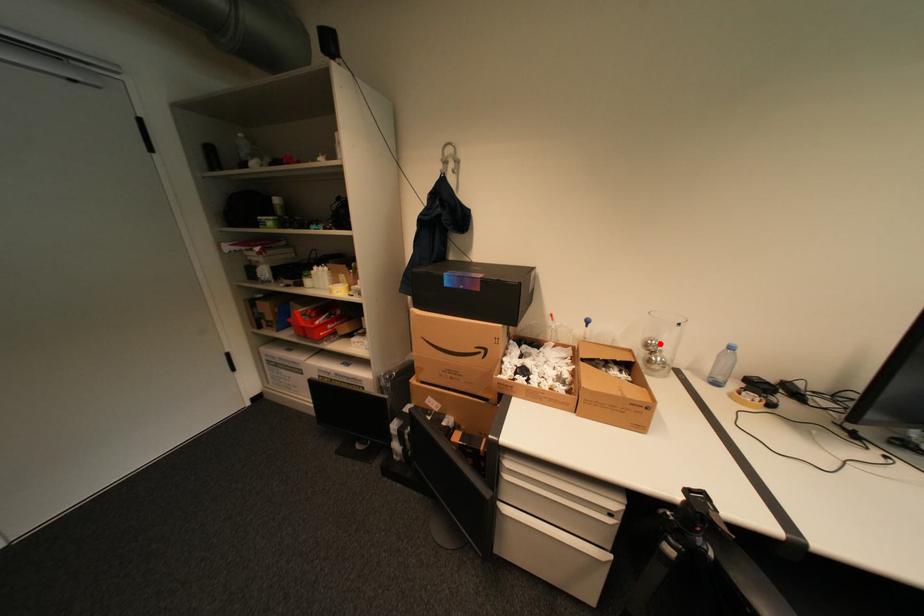
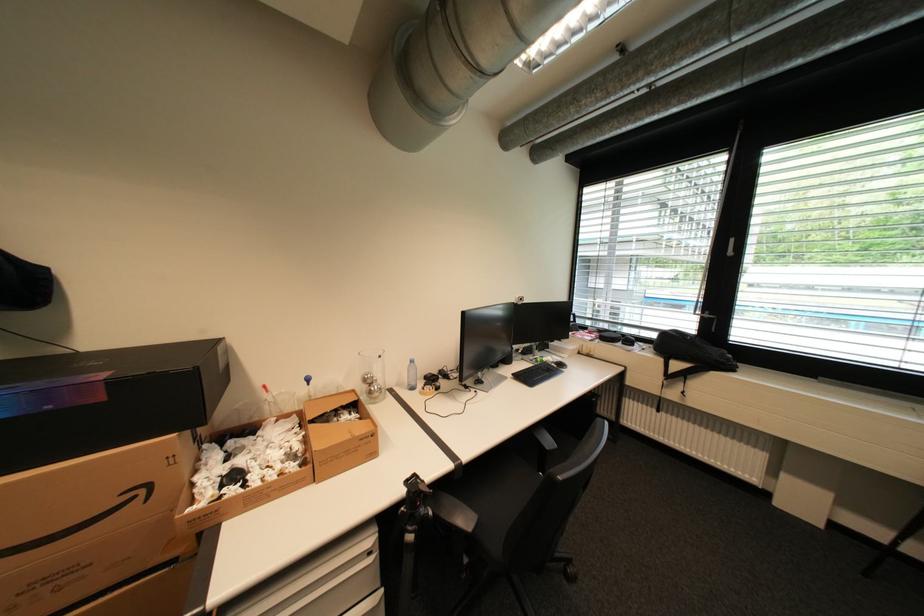
In the second image, find the point that corresponds to the highlighted location in the first image.

(377, 378)